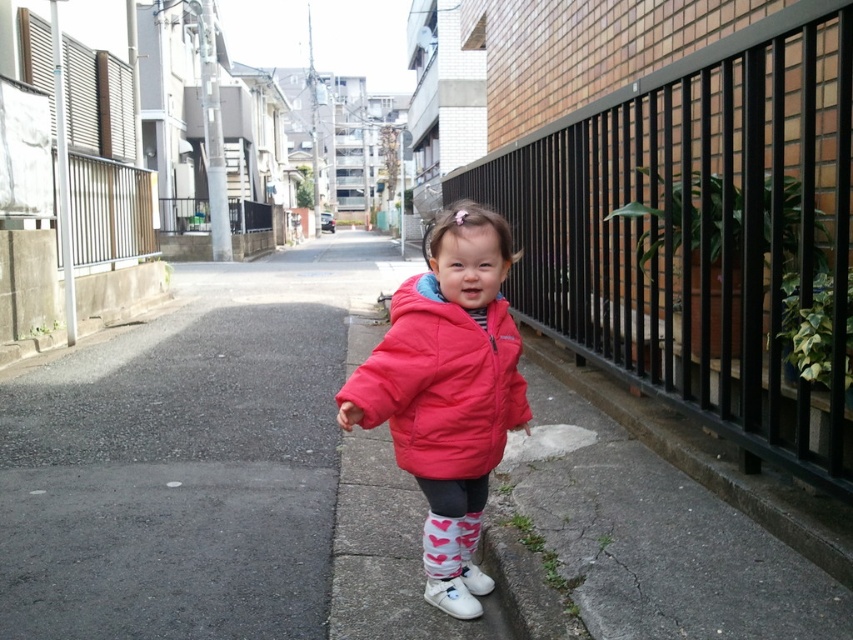
Does white fabric shoe at lower center have a smaller size compared to white matte shoe at lower center?

No.

Find the location of `white fabric shoe at lower center`. white fabric shoe at lower center is located at coordinates pos(459,593).

Is matte pink puffer jacket at center in front of white fabric shoe at lower center?

Yes, it is in front of white fabric shoe at lower center.

Is point (492, 426) behind point (459, 573)?

That is False.

Does point (407, 292) come closer to viewer compared to point (447, 588)?

Yes, point (407, 292) is in front of point (447, 588).

The image size is (853, 640). I want to click on matte pink puffer jacket at center, so click(x=440, y=384).

Is matte pink jacket at center bigger than gray concrete curb at lower right?

Incorrect, matte pink jacket at center is not larger than gray concrete curb at lower right.

Who is positioned more to the right, matte pink jacket at center or gray concrete curb at lower right?

From the viewer's perspective, gray concrete curb at lower right appears more on the right side.

Describe the element at coordinates (447, 378) in the screenshot. I see `matte pink jacket at center` at that location.

Locate an element on the screen. The width and height of the screenshot is (853, 640). matte pink jacket at center is located at coordinates (447, 378).